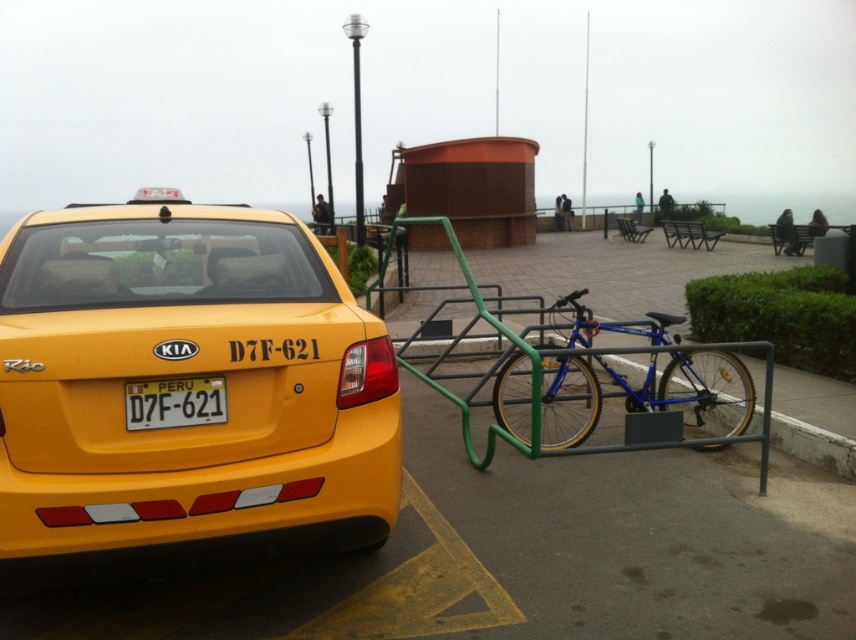
Between yellow matte taxi at upper left and blue metallic bicycle at center, which one appears on the left side from the viewer's perspective?

From the viewer's perspective, yellow matte taxi at upper left appears more on the left side.

Is yellow matte taxi at upper left shorter than blue metallic bicycle at center?

No, yellow matte taxi at upper left is not shorter than blue metallic bicycle at center.

Which is behind, point (34, 474) or point (580, 444)?

Point (580, 444)

Where is `yellow matte taxi at upper left`? The width and height of the screenshot is (856, 640). yellow matte taxi at upper left is located at coordinates (186, 378).

Is yellow matte taxi at upper left below green metal bike rack at center?

Yes, yellow matte taxi at upper left is below green metal bike rack at center.

The image size is (856, 640). What do you see at coordinates (186, 378) in the screenshot?
I see `yellow matte taxi at upper left` at bounding box center [186, 378].

Who is more forward, (x=152, y=241) or (x=526, y=342)?

Point (x=152, y=241)

Locate an element on the screen. The width and height of the screenshot is (856, 640). yellow matte taxi at upper left is located at coordinates (186, 378).

Is green metal bike rack at center behind yellow plastic license plate at rear?

Yes.

Is green metal bike rack at center to the left of yellow plastic license plate at rear from the viewer's perspective?

Incorrect, green metal bike rack at center is not on the left side of yellow plastic license plate at rear.

What do you see at coordinates (465, 284) in the screenshot?
I see `green metal bike rack at center` at bounding box center [465, 284].

Find the location of a particular element. green metal bike rack at center is located at coordinates (465, 284).